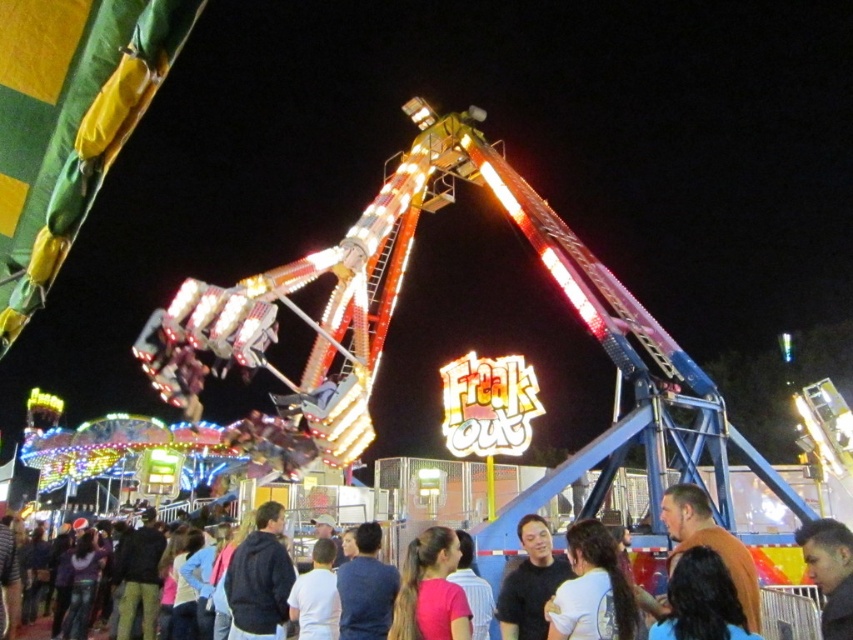
Which is in front, point (247, 545) or point (563, 573)?

Point (563, 573) is more forward.

Does black matte jacket at lower left lie in front of dark brown shirt at center?

No, it is behind dark brown shirt at center.

The width and height of the screenshot is (853, 640). What are the coordinates of `black matte jacket at lower left` in the screenshot? It's located at point(259,577).

Where is `black matte jacket at lower left`? black matte jacket at lower left is located at coordinates pyautogui.click(x=259, y=577).

Does shiny metallic ride at center have a lesser width compared to dark brown shirt at center?

No, shiny metallic ride at center is not thinner than dark brown shirt at center.

Who is more forward, [386,243] or [517,625]?

Positioned in front is point [517,625].

Which is behind, point (630, 307) or point (543, 625)?

Point (630, 307)

This screenshot has width=853, height=640. I want to click on shiny metallic ride at center, so click(390, 292).

Between brown fuzzy sweater at lower right and smooth black hair at center, which one appears on the right side from the viewer's perspective?

From the viewer's perspective, smooth black hair at center appears more on the right side.

Does point (743, 566) come farther from viewer compared to point (846, 538)?

Yes.

You are a GUI agent. You are given a task and a screenshot of the screen. Output one action in this format:
    pyautogui.click(x=<x>, y=<y>)
    Task: Click on the brown fuzzy sweater at lower right
    
    Given the screenshot: What is the action you would take?
    pyautogui.click(x=711, y=544)

The image size is (853, 640). I want to click on brown fuzzy sweater at lower right, so click(711, 544).